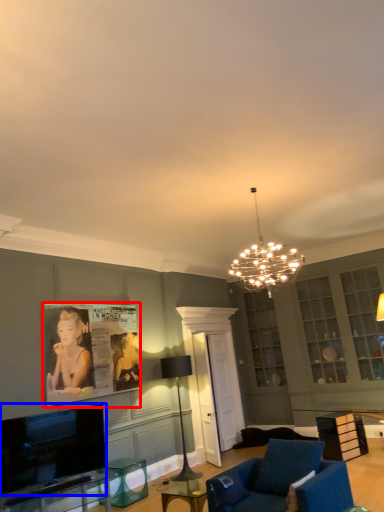
Question: Which of the following is the farthest to the observer, picture frame (highlighted by a red box) or television (highlighted by a blue box)?

Choices:
 (A) picture frame
 (B) television

Answer: (A)